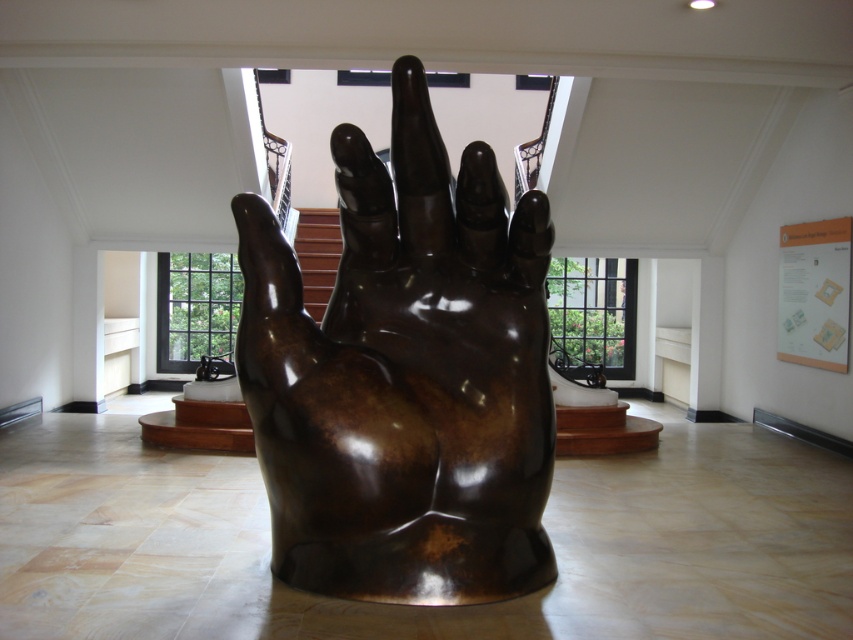
Who is lower down, shiny bronze hand at center or brown wooden stairs at center?

shiny bronze hand at center is below.

Does shiny bronze hand at center lie behind brown wooden stairs at center?

No, it is not.

Who is more forward, [338,188] or [323,264]?

Positioned in front is point [338,188].

The width and height of the screenshot is (853, 640). What are the coordinates of `shiny bronze hand at center` in the screenshot? It's located at (405, 376).